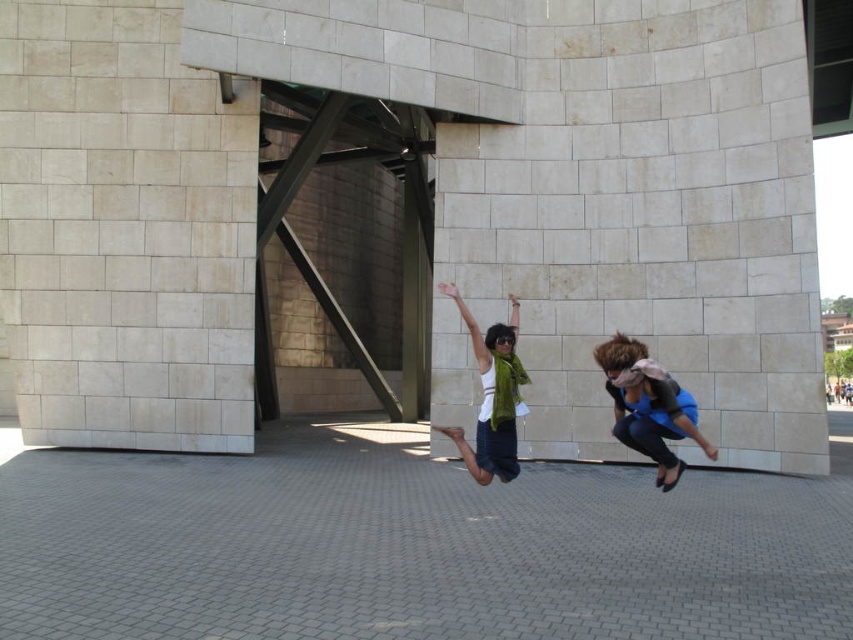
Question: Which object is farther from the camera taking this photo?

Choices:
 (A) beige stone pillar at lower left
 (B) blue fabric at center

Answer: (A)

Question: Does beige stone pillar at lower left appear on the left side of green scarf at center?

Choices:
 (A) yes
 (B) no

Answer: (A)

Question: Estimate the real-world distances between objects in this image. Which object is farther from the blue fabric at center?

Choices:
 (A) green scarf at center
 (B) beige stone pillar at lower left

Answer: (B)

Question: Which is farther from the blue fabric at center?

Choices:
 (A) green scarf at center
 (B) beige stone pillar at lower left

Answer: (B)

Question: Is beige stone pillar at lower left in front of green scarf at center?

Choices:
 (A) no
 (B) yes

Answer: (A)

Question: Does beige stone pillar at lower left appear under green scarf at center?

Choices:
 (A) yes
 (B) no

Answer: (B)